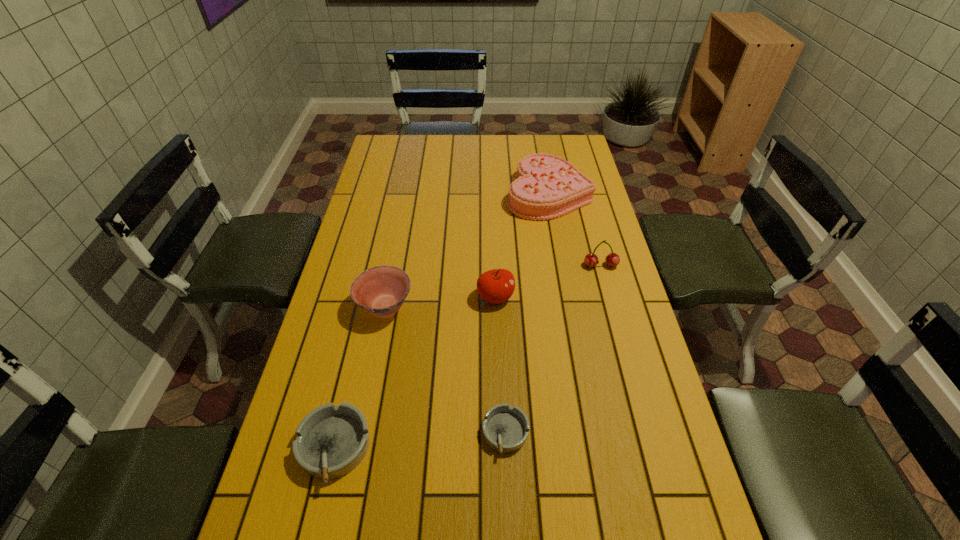
Considering the uniform spacing of ashtrays, where should an additional ashtray be positioned on the right? Please locate a free spot. Please provide its 2D coordinates. Your answer should be formatted as a tuple, i.e. [(x, y)], where the tuple contains the x and y coordinates of a point satisfying the conditions above.

[(669, 419)]